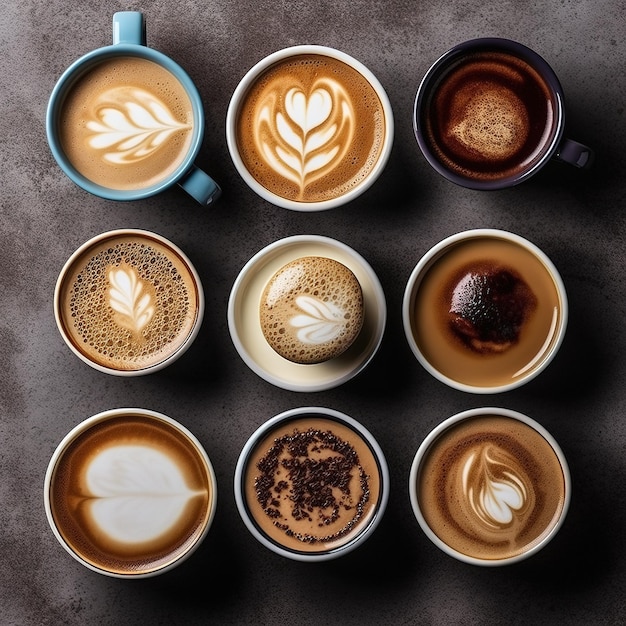
At what (x,y) coordinates should I click in order to perform the action: click on coffee in mugs. Please return your answer as a coordinate pair (x, y). Looking at the image, I should click on (148, 125), (334, 145), (490, 134), (484, 305), (313, 317), (105, 299), (136, 494), (310, 485), (491, 483).